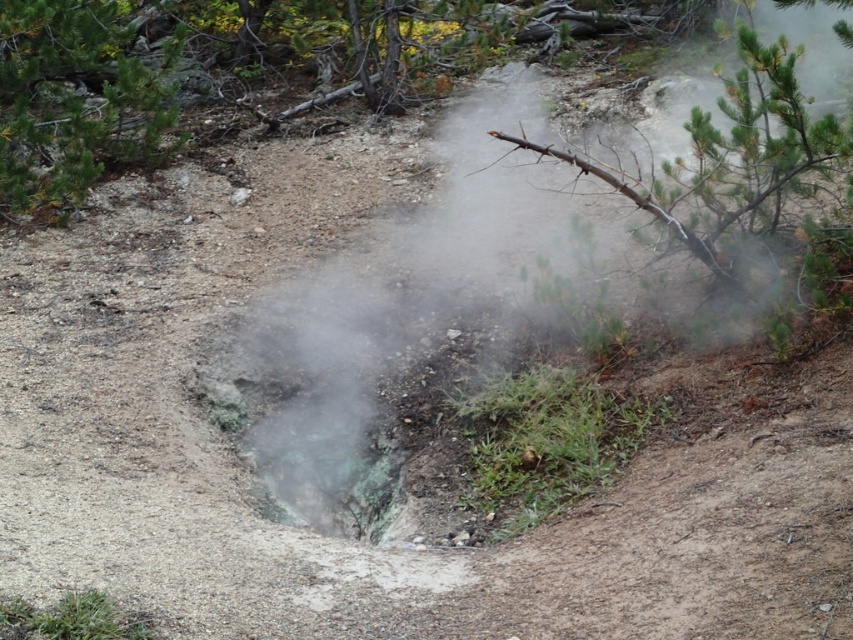
Question: Does green pine tree at upper left have a smaller size compared to green leafy branch at upper right?

Choices:
 (A) yes
 (B) no

Answer: (B)

Question: Among these objects, which one is nearest to the camera?

Choices:
 (A) green leafy branch at upper right
 (B) green pine tree at upper left

Answer: (A)

Question: Which point is closer to the camera?

Choices:
 (A) (67, 13)
 (B) (701, 230)

Answer: (B)

Question: Is green pine tree at upper left above green leafy branch at upper right?

Choices:
 (A) no
 (B) yes

Answer: (B)

Question: Which object is closer to the camera taking this photo?

Choices:
 (A) green pine tree at upper left
 (B) green leafy branch at upper right

Answer: (B)

Question: Is green pine tree at upper left wider than green leafy branch at upper right?

Choices:
 (A) no
 (B) yes

Answer: (A)